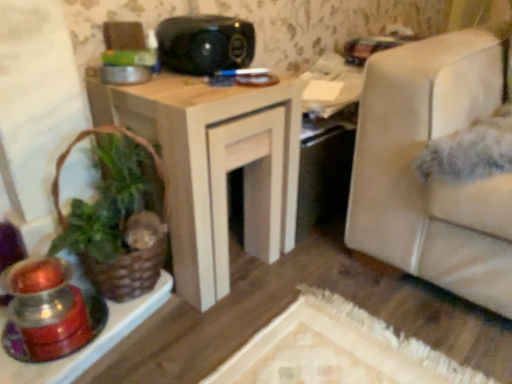
Question: Does translucent glass candle holder at lower left have a greater height compared to wooden table at center?

Choices:
 (A) yes
 (B) no

Answer: (B)

Question: From a real-world perspective, is translucent glass candle holder at lower left positioned over wooden table at center based on gravity?

Choices:
 (A) no
 (B) yes

Answer: (A)

Question: From the image's perspective, is translucent glass candle holder at lower left on wooden table at center?

Choices:
 (A) no
 (B) yes

Answer: (A)

Question: From a real-world perspective, is translucent glass candle holder at lower left positioned under wooden table at center based on gravity?

Choices:
 (A) no
 (B) yes

Answer: (B)

Question: Would you say translucent glass candle holder at lower left is outside wooden table at center?

Choices:
 (A) no
 (B) yes

Answer: (B)

Question: Can you confirm if translucent glass candle holder at lower left is wider than wooden table at center?

Choices:
 (A) no
 (B) yes

Answer: (A)

Question: Considering the relative positions of translucent glass candle holder at lower left and black plastic speaker at upper center in the image provided, is translucent glass candle holder at lower left to the right of black plastic speaker at upper center from the viewer's perspective?

Choices:
 (A) yes
 (B) no

Answer: (B)

Question: Is translucent glass candle holder at lower left beside black plastic speaker at upper center?

Choices:
 (A) yes
 (B) no

Answer: (B)

Question: Is translucent glass candle holder at lower left thinner than black plastic speaker at upper center?

Choices:
 (A) no
 (B) yes

Answer: (B)

Question: Is translucent glass candle holder at lower left bigger than black plastic speaker at upper center?

Choices:
 (A) no
 (B) yes

Answer: (A)

Question: Would you say translucent glass candle holder at lower left is a long distance from black plastic speaker at upper center?

Choices:
 (A) no
 (B) yes

Answer: (A)

Question: From a real-world perspective, is translucent glass candle holder at lower left on top of black plastic speaker at upper center?

Choices:
 (A) no
 (B) yes

Answer: (A)

Question: Is wooden table at center oriented away from brown woven basket at left?

Choices:
 (A) no
 (B) yes

Answer: (A)